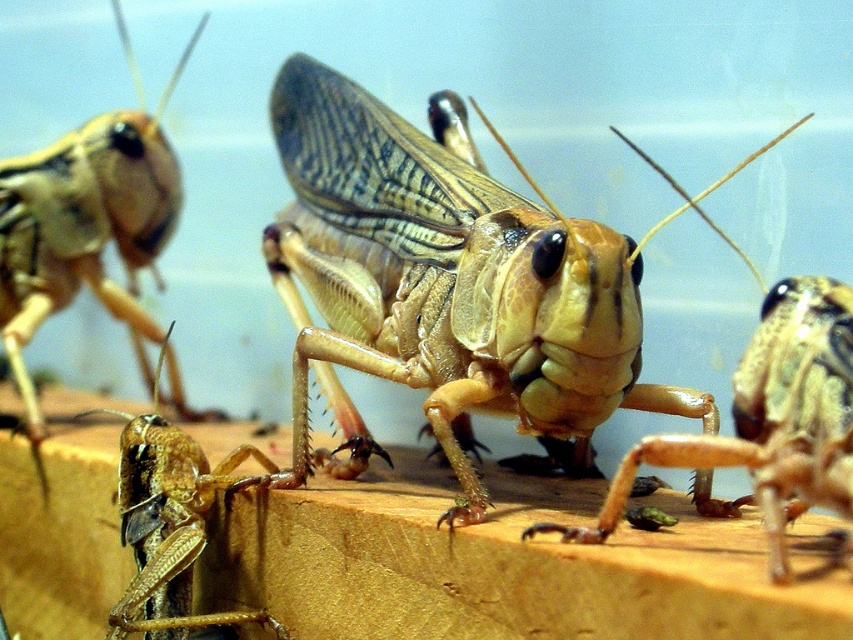
Question: Which of the following is the closest to the observer?

Choices:
 (A) (47, 266)
 (B) (213, 612)
 (C) (229, 440)

Answer: (B)

Question: Where is translucent yellow grasshopper at center located in relation to brown matte grasshopper at lower left in the image?

Choices:
 (A) left
 (B) right

Answer: (B)

Question: Is wooden plank at center to the left of translucent beige grasshopper at center from the viewer's perspective?

Choices:
 (A) no
 (B) yes

Answer: (B)

Question: Is wooden plank at center above translucent beige grasshopper at lower left?

Choices:
 (A) yes
 (B) no

Answer: (B)

Question: Which of these objects is positioned closest to the brown matte grasshopper at lower left?

Choices:
 (A) wooden plank at center
 (B) translucent yellow grasshopper at center
 (C) translucent beige grasshopper at center

Answer: (A)

Question: Which object appears farthest from the camera in this image?

Choices:
 (A) brown matte grasshopper at lower left
 (B) translucent yellow grasshopper at center

Answer: (A)